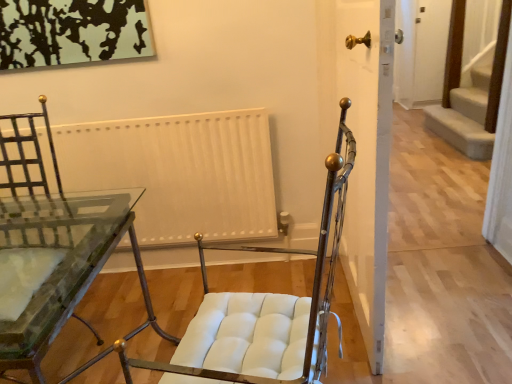
The width and height of the screenshot is (512, 384). Identify the location of white matte door at center. (361, 145).

This screenshot has width=512, height=384. What do you see at coordinates (361, 145) in the screenshot?
I see `white matte door at center` at bounding box center [361, 145].

Where is `metallic/textured chair at center`? metallic/textured chair at center is located at coordinates (263, 312).

The width and height of the screenshot is (512, 384). What do you see at coordinates (179, 172) in the screenshot?
I see `white matte radiator at center` at bounding box center [179, 172].

What are the coordinates of `clear glass table at center` in the screenshot? It's located at (60, 263).

The width and height of the screenshot is (512, 384). What do you see at coordinates (60, 263) in the screenshot?
I see `clear glass table at center` at bounding box center [60, 263].

You are a GUI agent. You are given a task and a screenshot of the screen. Output one action in this format:
    pyautogui.click(x=<x>, y=<y>)
    Task: Click on the white matte door at center
    This screenshot has width=512, height=384.
    Given the screenshot: What is the action you would take?
    pyautogui.click(x=361, y=145)

Measure the distance between clear glass table at center and metallic/textured chair at center.

They are 39.07 inches apart.

From a real-world perspective, who is located lower, clear glass table at center or metallic/textured chair at center?

clear glass table at center, from a real-world perspective.

In the image, there is a metallic/textured chair at center. Identify the location of table below it (from the image's perspective). This screenshot has width=512, height=384. (60, 263).

Looking at this image, how different are the orientations of clear glass table at center and metallic/textured chair at center in degrees?

The angular difference between clear glass table at center and metallic/textured chair at center is 14.6 degrees.

From the image's perspective, which one is positioned higher, white matte door at center or metallic/textured chair at center?

white matte door at center.

Between white matte door at center and metallic/textured chair at center, which one is positioned behind?

white matte door at center is further away from the camera.

Is white matte door at center oriented towards metallic/textured chair at center?

No, white matte door at center is not turned towards metallic/textured chair at center.

Considering the relative sizes of white matte door at center and metallic/textured chair at center in the image provided, is white matte door at center bigger than metallic/textured chair at center?

No, white matte door at center is not bigger than metallic/textured chair at center.

Can you tell me how much metallic/textured chair at center and white matte door at center differ in facing direction?

104 degrees.

Visually, is metallic/textured chair at center positioned to the left or to the right of white matte door at center?

From the image, it's evident that metallic/textured chair at center is to the left of white matte door at center.

This screenshot has height=384, width=512. In order to click on chair in front of the white matte door at center in this screenshot , I will do `click(263, 312)`.

Can you confirm if metallic/textured chair at center is taller than white matte door at center?

No, metallic/textured chair at center is not taller than white matte door at center.

Is white matte radiator at center bigger or smaller than white matte door at center?

In the image, white matte radiator at center appears to be smaller than white matte door at center.

Which object is closer to the camera taking this photo, white matte radiator at center or white matte door at center?

white matte door at center is in front.

Which is more to the right, white matte radiator at center or white matte door at center?

white matte door at center is more to the right.

Would you say white matte door at center is part of white matte radiator at center's contents?

No, white matte radiator at center does not contain white matte door at center.

What's the angular difference between white matte radiator at center and metallic/textured chair at center's facing directions?

There is a 12.9-degree angle between the facing directions of white matte radiator at center and metallic/textured chair at center.

Based on the photo, from a real-world perspective, is white matte radiator at center located beneath metallic/textured chair at center?

Correct, in the physical world, white matte radiator at center is lower than metallic/textured chair at center.

In terms of width, does white matte radiator at center look wider or thinner when compared to metallic/textured chair at center?

white matte radiator at center is thinner than metallic/textured chair at center.

From the image's perspective, is white matte door at center beneath clear glass table at center?

Incorrect, from the image's perspective, white matte door at center is higher than clear glass table at center.

Are white matte door at center and clear glass table at center beside each other?

No, white matte door at center is not next to clear glass table at center.

Find the location of `door above the clear glass table at center (from a real-world perspective)`. door above the clear glass table at center (from a real-world perspective) is located at coordinates (361, 145).

Considering the relative sizes of white matte door at center and clear glass table at center in the image provided, is white matte door at center taller than clear glass table at center?

Indeed, white matte door at center has a greater height compared to clear glass table at center.

From the image's perspective, which is above, metallic/textured chair at center or clear glass table at center?

metallic/textured chair at center is shown above in the image.

Is point (222, 342) closer to viewer compared to point (115, 204)?

That is True.

Is metallic/textured chair at center in contact with clear glass table at center?

metallic/textured chair at center is not next to clear glass table at center, and they're not touching.

Can clear glass table at center be found inside metallic/textured chair at center?

No, clear glass table at center is not inside metallic/textured chair at center.

Locate an element on the screen. This screenshot has width=512, height=384. table that appears behind the metallic/textured chair at center is located at coordinates (60, 263).

I want to click on door that is above the metallic/textured chair at center (from the image's perspective), so click(x=361, y=145).

Considering their positions, is white matte radiator at center positioned further to white matte door at center than metallic/textured chair at center?

Among the two, white matte radiator at center is located further to white matte door at center.

Based on their spatial positions, is metallic/textured chair at center or white matte radiator at center further from clear glass table at center?

metallic/textured chair at center lies further to clear glass table at center than the other object.

Estimate the real-world distances between objects in this image. Which object is closer to white matte door at center, white matte radiator at center or clear glass table at center?

white matte radiator at center is closer to white matte door at center.

Based on their spatial positions, is white matte radiator at center or metallic/textured chair at center further from clear glass table at center?

Among the two, metallic/textured chair at center is located further to clear glass table at center.

Based on the photo, looking at the image, which one is located closer to white matte radiator at center, white matte door at center or metallic/textured chair at center?

white matte door at center lies closer to white matte radiator at center than the other object.

When comparing their distances from white matte door at center, does clear glass table at center or white matte radiator at center seem further?

clear glass table at center is positioned further to the anchor white matte door at center.

Which object lies further to the anchor point white matte door at center, metallic/textured chair at center or clear glass table at center?

Based on the image, clear glass table at center appears to be further to white matte door at center.

Which object lies nearer to the anchor point metallic/textured chair at center, white matte radiator at center or white matte door at center?

Based on the image, white matte door at center appears to be nearer to metallic/textured chair at center.

The height and width of the screenshot is (384, 512). Identify the location of door positioned between metallic/textured chair at center and white matte radiator at center from near to far. (361, 145).

At what (x,y) coordinates should I click in order to perform the action: click on radiator between clear glass table at center and white matte door at center from left to right. Please return your answer as a coordinate pair (x, y). This screenshot has width=512, height=384. Looking at the image, I should click on (179, 172).

Find the location of `chair between clear glass table at center and white matte door at center`. chair between clear glass table at center and white matte door at center is located at coordinates (263, 312).

At what (x,y) coordinates should I click in order to perform the action: click on table between metallic/textured chair at center and white matte radiator at center in the front-back direction. Please return your answer as a coordinate pair (x, y). Looking at the image, I should click on (60, 263).